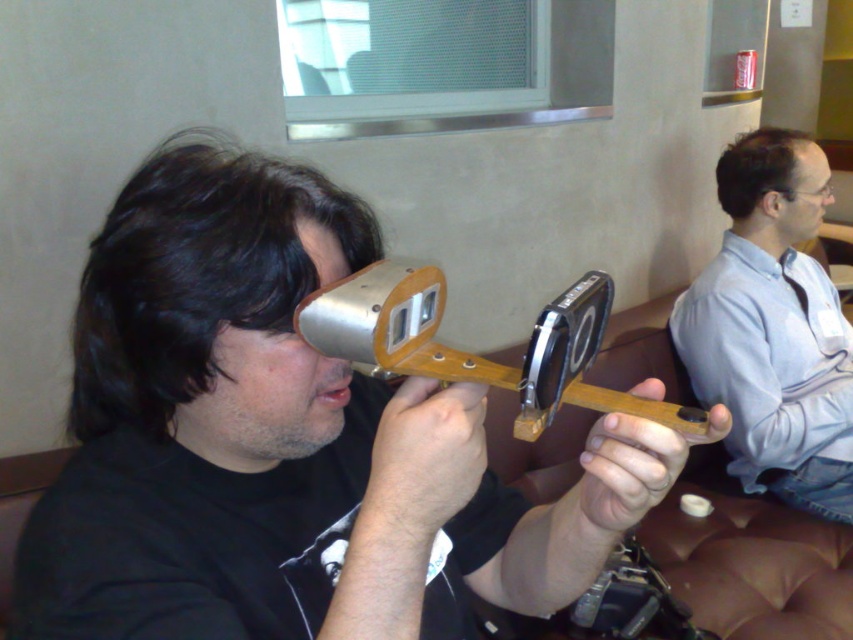
Looking at this image, you are a photographer trying to capture a photo of the matte black device at center and the light blue shirt at right. Based on their positions, which object should you focus on first if you want to ensure both are in the frame?

The matte black device at center is positioned on the left side of light blue shirt at right, so you should focus on the matte black device at center first to ensure both are in the frame.